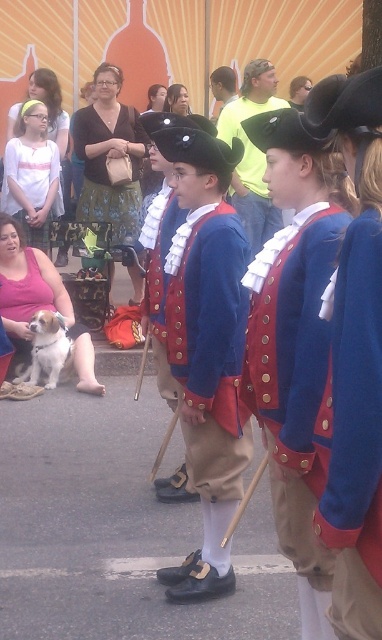
Question: Is the position of matte blue fabric vest at center less distant than that of white fur dog at lower left?

Choices:
 (A) yes
 (B) no

Answer: (A)

Question: Considering the real-world distances, which object is farthest from the matte blue fabric vest at center?

Choices:
 (A) white cotton shirt at upper left
 (B) red velvet vest at center
 (C) matte yellow shirt at center

Answer: (A)

Question: Is matte blue fabric vest at center above white fur dog at lower left?

Choices:
 (A) yes
 (B) no

Answer: (A)

Question: Which object appears farthest from the camera in this image?

Choices:
 (A) white cotton shirt at upper left
 (B) matte blue fabric vest at center
 (C) red velvet vest at center
 (D) blue woolen vest at center

Answer: (A)

Question: Among these objects, which one is nearest to the camera?

Choices:
 (A) blue woolen vest at center
 (B) red velvet vest at center
 (C) white cotton shirt at upper left

Answer: (A)

Question: Can you confirm if blue woolen vest at center is thinner than white cotton shirt at upper left?

Choices:
 (A) no
 (B) yes

Answer: (B)